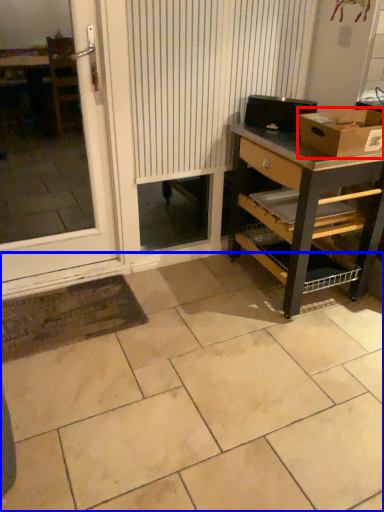
Question: Which of the following is the closest to the observer, box (highlighted by a red box) or ceramic tile (highlighted by a blue box)?

Choices:
 (A) box
 (B) ceramic tile

Answer: (B)